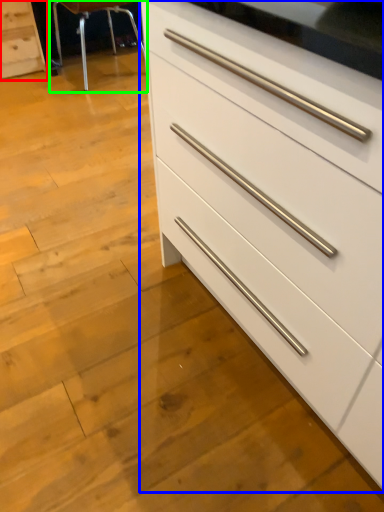
Question: Which is farther away from chest of drawers (highlighted by a red box)? chest of drawers (highlighted by a blue box) or bar stool (highlighted by a green box)?

Choices:
 (A) chest of drawers
 (B) bar stool

Answer: (A)